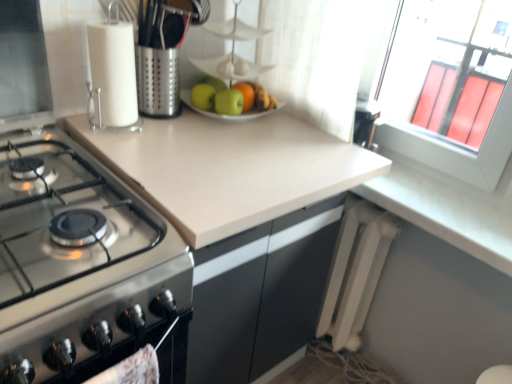
Question: In terms of width, does glossy orange at center look wider or thinner when compared to stainless steel gas stove at left?

Choices:
 (A) wide
 (B) thin

Answer: (B)

Question: From the image's perspective, is glossy orange at center positioned above or below stainless steel gas stove at left?

Choices:
 (A) above
 (B) below

Answer: (A)

Question: Which object is positioned farthest from the stainless steel gas stove at left?

Choices:
 (A) white plastic radiator at lower right
 (B) beige laminate countertop at center
 (C) white paper towel holder at upper left
 (D) white matte counter top at lower right
 (E) glossy orange at center

Answer: (A)

Question: Based on their relative distances, which object is farther from the white plastic radiator at lower right?

Choices:
 (A) white matte counter top at lower right
 (B) green matte apple at center, which is the 1th apple from right to left
 (C) glossy orange at center
 (D) stainless steel gas stove at left
 (E) white paper towel holder at upper left

Answer: (D)